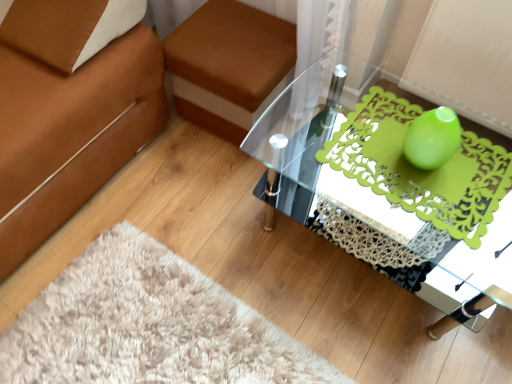
Image resolution: width=512 pixels, height=384 pixels. In order to click on transparent glass table at center in this screenshot , I will do `click(394, 179)`.

The width and height of the screenshot is (512, 384). Describe the element at coordinates (227, 64) in the screenshot. I see `brown fabric footrest at upper center` at that location.

Find the location of `teal glass vase at center`. teal glass vase at center is located at coordinates (432, 138).

I want to click on design in front of the brown fabric footrest at upper center, so click(x=422, y=169).

From a real-world perspective, does brown fabric footrest at upper center sit lower than green matte vase at upper right?

Yes, from a real-world perspective, brown fabric footrest at upper center is under green matte vase at upper right.

Which of these two, brown fabric footrest at upper center or green matte vase at upper right, is bigger?

Bigger between the two is brown fabric footrest at upper center.

Considering the positions of points (254, 23) and (413, 196), is point (254, 23) closer to camera compared to point (413, 196)?

No.

From the picture: Do you think green matte vase at upper right is within teal glass vase at center, or outside of it?

The correct answer is: outside.

Is green matte vase at upper right wider or thinner than teal glass vase at center?

Clearly, green matte vase at upper right has more width compared to teal glass vase at center.

Where is `design that is on the right side of teal glass vase at center`? Image resolution: width=512 pixels, height=384 pixels. design that is on the right side of teal glass vase at center is located at coordinates (422, 169).

Considering the positions of objects green matte vase at upper right and teal glass vase at center in the image provided, who is behind, green matte vase at upper right or teal glass vase at center?

green matte vase at upper right is behind.

From the image's perspective, which one is positioned lower, transparent glass table at center or brown fabric footrest at upper center?

transparent glass table at center is shown below in the image.

How many degrees apart are the facing directions of transparent glass table at center and brown fabric footrest at upper center?

transparent glass table at center and brown fabric footrest at upper center are facing 2.65 degrees away from each other.

From a real-world perspective, who is located lower, transparent glass table at center or brown fabric footrest at upper center?

brown fabric footrest at upper center is physically lower.

Is brown fabric footrest at upper center smaller than transparent glass table at center?

Yes, brown fabric footrest at upper center is smaller than transparent glass table at center.

Looking at their sizes, would you say brown fabric footrest at upper center is wider or thinner than transparent glass table at center?

In the image, brown fabric footrest at upper center appears to be more narrow than transparent glass table at center.

Is transparent glass table at center completely or partially inside brown fabric footrest at upper center?

No.

Which of these two, green matte vase at upper right or transparent glass table at center, is smaller?

With smaller size is green matte vase at upper right.

Consider the image. In the image, is green matte vase at upper right on the left side or the right side of transparent glass table at center?

In the image, green matte vase at upper right appears on the right side of transparent glass table at center.

From a real-world perspective, is green matte vase at upper right positioned above or below transparent glass table at center?

In terms of real-world spatial position, green matte vase at upper right is above transparent glass table at center.

Is green matte vase at upper right located outside transparent glass table at center?

No, most part of green matte vase at upper right lies within transparent glass table at center.

In order to click on footrest that is on the left side of teal glass vase at center in this screenshot , I will do `click(227, 64)`.

Is brown fabric footrest at upper center behind teal glass vase at center?

Yes, it is.

Is brown fabric footrest at upper center to the right of teal glass vase at center from the viewer's perspective?

No.

From their relative heights in the image, would you say brown fabric footrest at upper center is taller or shorter than teal glass vase at center?

brown fabric footrest at upper center is taller than teal glass vase at center.

Does teal glass vase at center have a lesser width compared to transparent glass table at center?

Yes, teal glass vase at center is thinner than transparent glass table at center.

Is teal glass vase at center taller or shorter than transparent glass table at center?

Clearly, teal glass vase at center is shorter compared to transparent glass table at center.

Who is bigger, teal glass vase at center or transparent glass table at center?

Bigger between the two is transparent glass table at center.

Is teal glass vase at center placed right next to transparent glass table at center?

No, teal glass vase at center is not with transparent glass table at center.

Identify the location of footrest on the left of green matte vase at upper right. (227, 64).

The image size is (512, 384). I want to click on design directly beneath the teal glass vase at center (from a real-world perspective), so click(422, 169).

From the image, which object appears to be nearer to brown fabric footrest at upper center, teal glass vase at center or green matte vase at upper right?

green matte vase at upper right lies closer to brown fabric footrest at upper center than the other object.

From the picture: Looking at the image, which one is located closer to teal glass vase at center, transparent glass table at center or green matte vase at upper right?

green matte vase at upper right is closer to teal glass vase at center.

Which object lies further to the anchor point brown fabric footrest at upper center, transparent glass table at center or teal glass vase at center?

teal glass vase at center is further to brown fabric footrest at upper center.

Which object lies nearer to the anchor point green matte vase at upper right, brown fabric footrest at upper center or teal glass vase at center?

The object closer to green matte vase at upper right is teal glass vase at center.

Considering their positions, is transparent glass table at center positioned further to teal glass vase at center than brown fabric footrest at upper center?

The object further to teal glass vase at center is brown fabric footrest at upper center.

Based on their spatial positions, is green matte vase at upper right or brown fabric footrest at upper center closer to transparent glass table at center?

green matte vase at upper right is positioned closer to the anchor transparent glass table at center.

Considering their positions, is teal glass vase at center positioned further to transparent glass table at center than green matte vase at upper right?

teal glass vase at center is positioned further to the anchor transparent glass table at center.

From the image, which object appears to be nearer to green matte vase at upper right, transparent glass table at center or brown fabric footrest at upper center?

transparent glass table at center.

Image resolution: width=512 pixels, height=384 pixels. Identify the location of table between brown fabric footrest at upper center and teal glass vase at center. (394, 179).

Where is `design between teal glass vase at center and transparent glass table at center vertically`? The height and width of the screenshot is (384, 512). design between teal glass vase at center and transparent glass table at center vertically is located at coordinates (422, 169).

I want to click on table between brown fabric footrest at upper center and green matte vase at upper right, so click(394, 179).

Locate an element on the screen. Image resolution: width=512 pixels, height=384 pixels. teal between brown fabric footrest at upper center and green matte vase at upper right in the horizontal direction is located at coordinates (x=432, y=138).